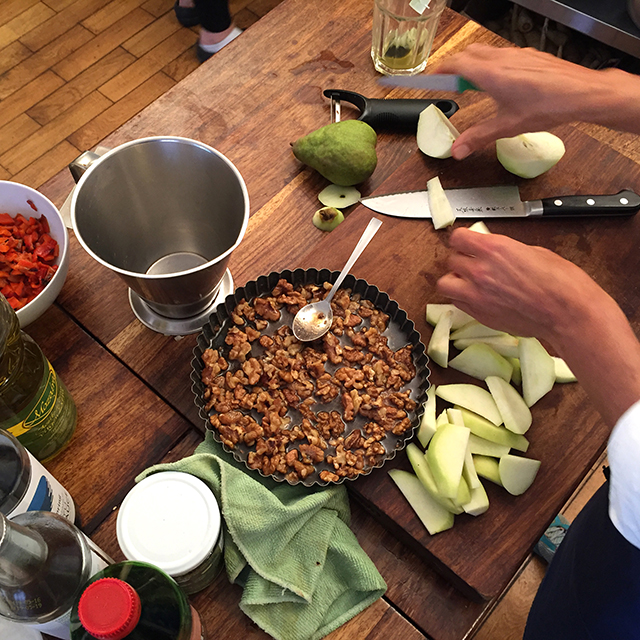
Find the location of a particular element. spoon is located at coordinates (306, 326).